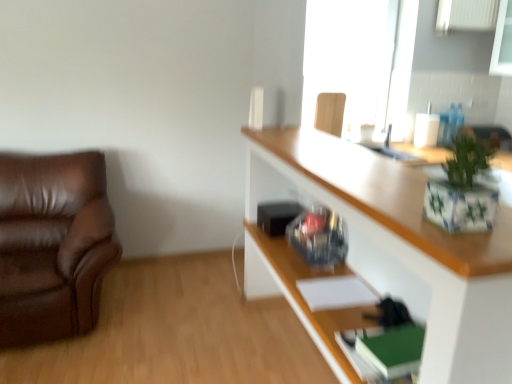
Find the location of a particular element. free region on the left part of green ceramic pot at upper right is located at coordinates (401, 217).